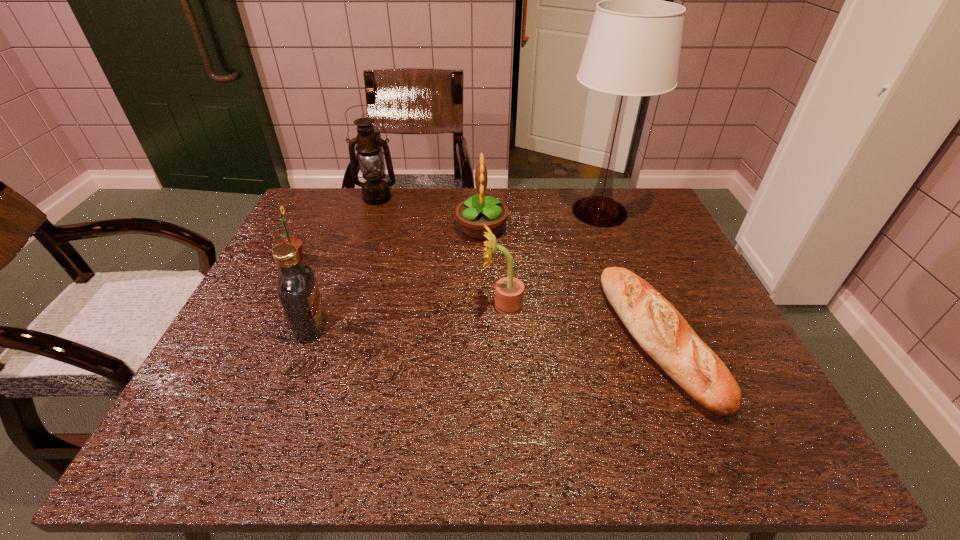
At what (x,y) coordinates should I click in order to perform the action: click on empty space between the vodka and the farthest sunflower. Please return your answer as a coordinate pair (x, y). The width and height of the screenshot is (960, 540). Looking at the image, I should click on (396, 278).

Locate an element on the screen. This screenshot has height=540, width=960. free spot between the fourth farthest object and the nearest sunflower is located at coordinates (399, 282).

What are the coordinates of `free space that is in between the vodka and the table lamp` in the screenshot? It's located at (455, 270).

Locate an element on the screen. empty space between the table lamp and the vodka is located at coordinates (455, 270).

The image size is (960, 540). I want to click on free space that is in between the table lamp and the leftmost sunflower, so click(x=447, y=235).

At what (x,y) coordinates should I click in order to perform the action: click on free space between the vodka and the oil lamp. Please return your answer as a coordinate pair (x, y). The width and height of the screenshot is (960, 540). Looking at the image, I should click on (345, 262).

Find the location of a particular element. This screenshot has height=540, width=960. vacant point located between the farthest sunflower and the nearest sunflower is located at coordinates (492, 267).

Identify which object is located as the sixth nearest to the nearest sunflower. Please provide its 2D coordinates. Your answer should be formatted as a tuple, i.e. [(x, y)], where the tuple contains the x and y coordinates of a point satisfying the conditions above.

[(296, 242)]

Select which object appears as the sixth closest to the baguet. Please provide its 2D coordinates. Your answer should be formatted as a tuple, i.e. [(x, y)], where the tuple contains the x and y coordinates of a point satisfying the conditions above.

[(296, 242)]

Select which sunflower is the closest to the nearest sunflower. Please provide its 2D coordinates. Your answer should be formatted as a tuple, i.e. [(x, y)], where the tuple contains the x and y coordinates of a point satisfying the conditions above.

[(471, 214)]